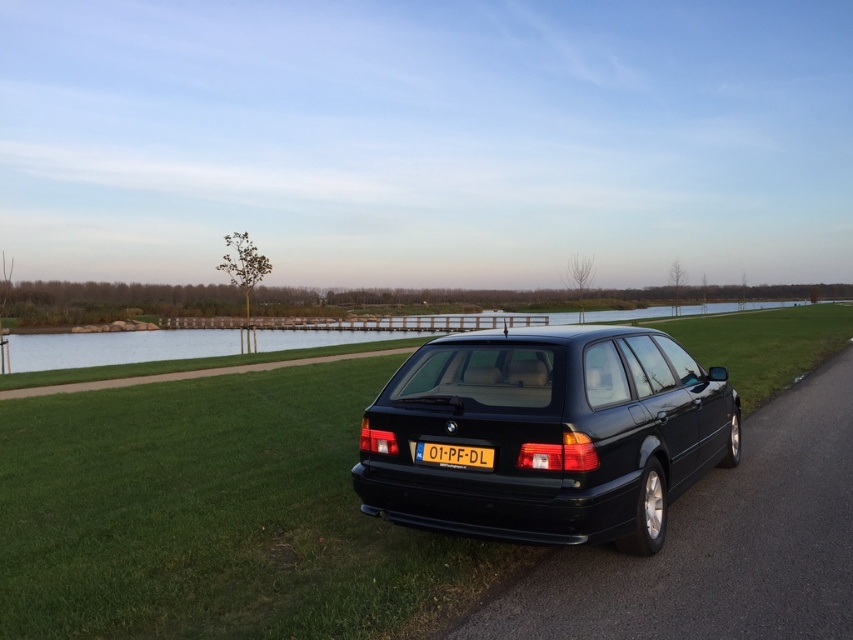
You are a gardener who needs to mow the lawn. You see the green grass at center and the glossy black station wagon at center. Which area should you avoid mowing to prevent damaging the vehicle?

You should avoid mowing near the glossy black station wagon at center because the green grass at center is much taller, indicating it is the area that needs mowing, while the station wagon is a vehicle and shouldn

You are a photographer trying to capture the yellow plastic license plate at center while avoiding the glossy black station wagon at center. Is the license plate visible without the car blocking it?

The glossy black station wagon at center is above the yellow plastic license plate at center, so the car is blocking the license plate. You cannot see the license plate without the car blocking it.